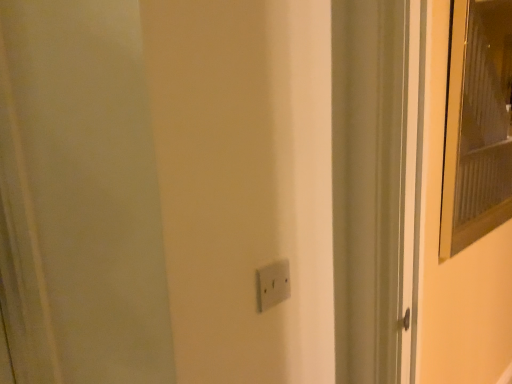
The image size is (512, 384). Find the location of `white plastic light switch at center`. white plastic light switch at center is located at coordinates 273,284.

The width and height of the screenshot is (512, 384). What do you see at coordinates (273, 284) in the screenshot? I see `white plastic light switch at center` at bounding box center [273, 284].

At what (x,y) coordinates should I click in order to perform the action: click on white plastic light switch at center. Please return your answer as a coordinate pair (x, y). Looking at the image, I should click on (273, 284).